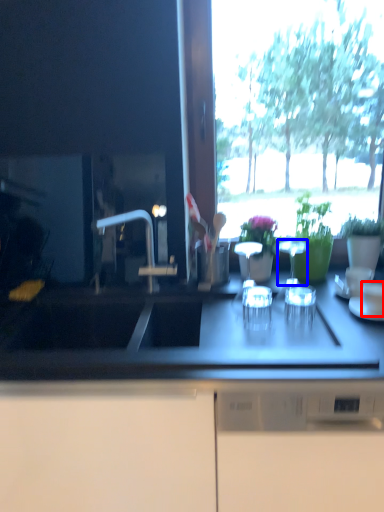
Question: Which object appears farthest to the camera in this image, tableware (highlighted by a red box) or tableware (highlighted by a blue box)?

Choices:
 (A) tableware
 (B) tableware

Answer: (B)